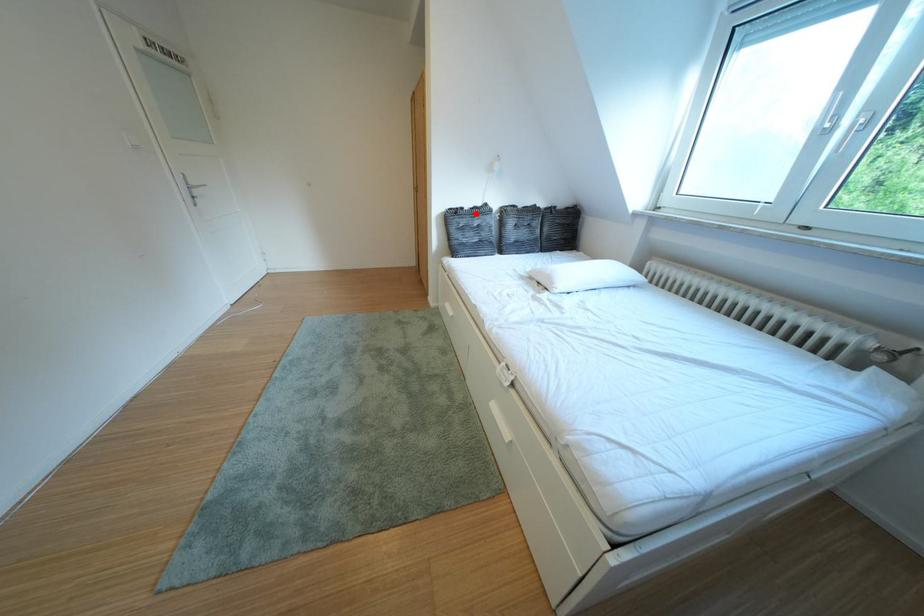
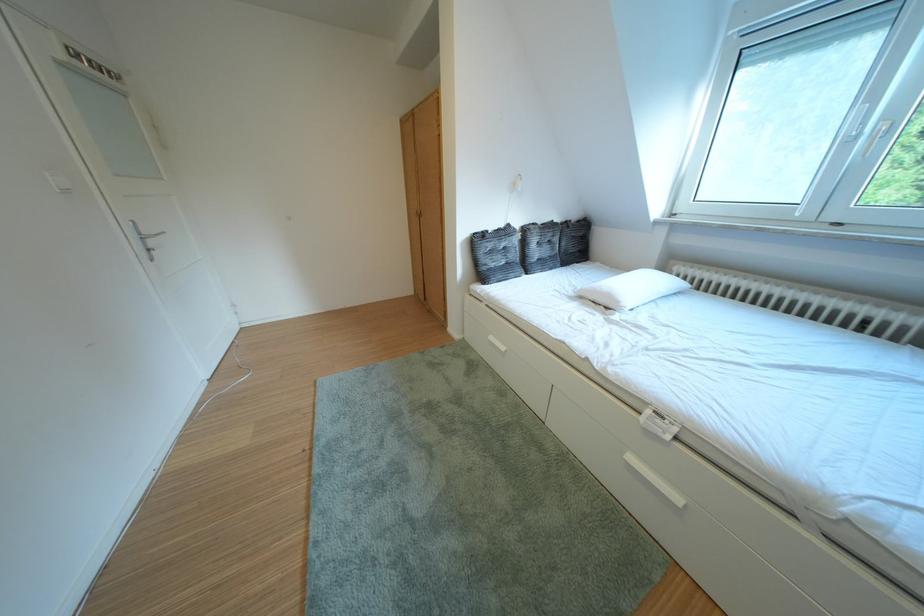
In the second image, find the point that corresponds to the highlighted location in the first image.

(500, 237)